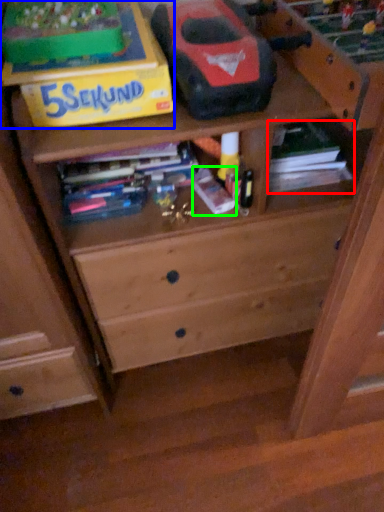
Question: Which object is the closest to the book (highlighted by a red box)? Choose among these: cardboard box (highlighted by a blue box) or book (highlighted by a green box).

Choices:
 (A) cardboard box
 (B) book

Answer: (B)